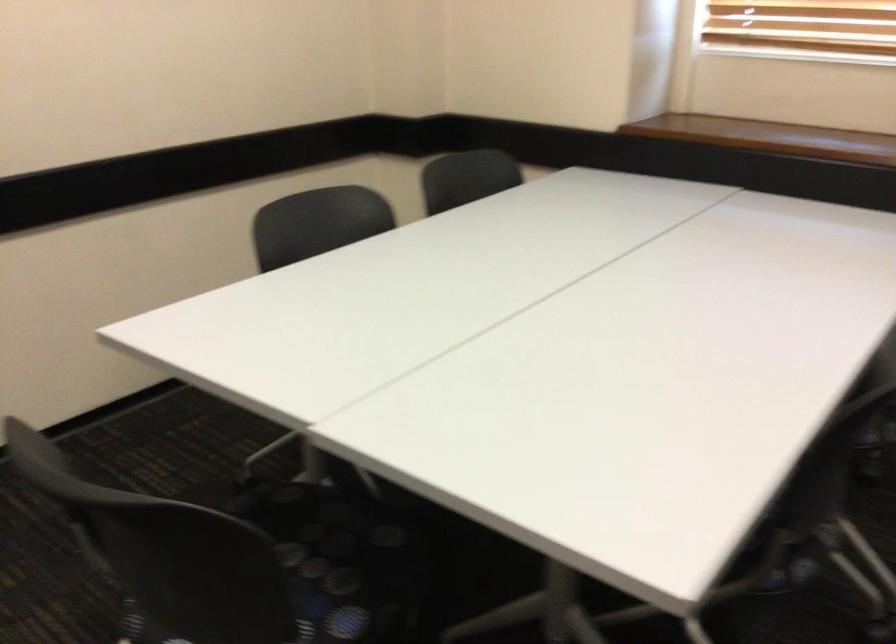
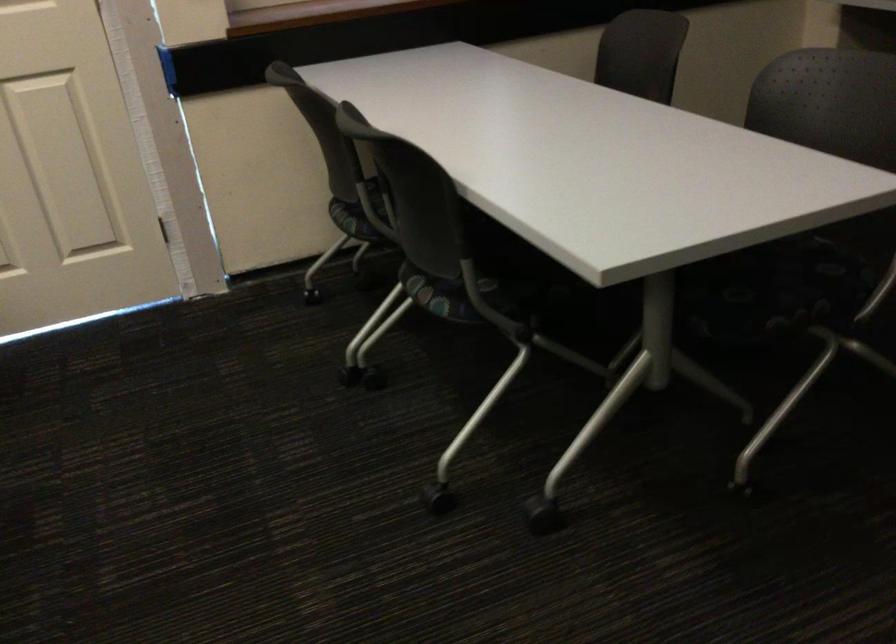
The first image is from the beginning of the video and the second image is from the end. How did the camera likely rotate when shooting the video?

The camera's rotation is toward right-down.